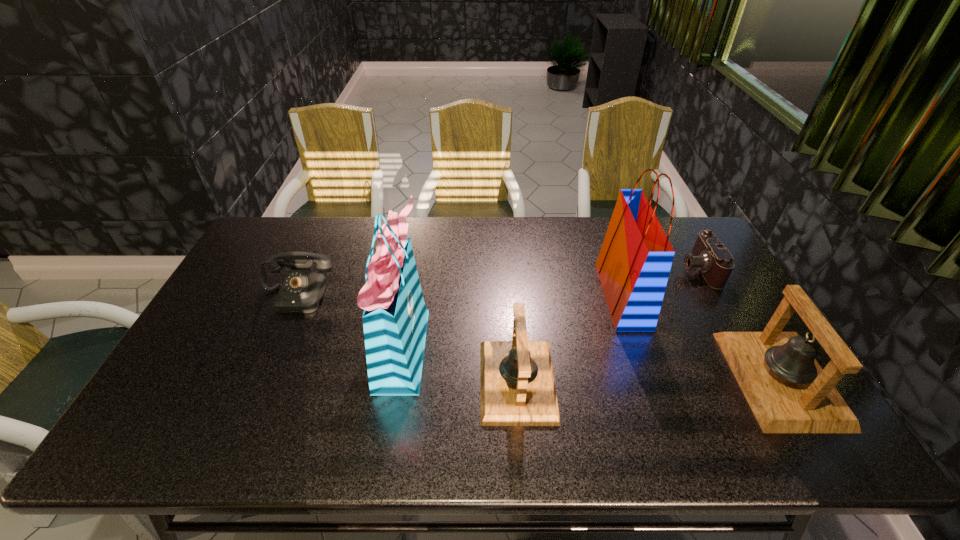
Locate an element on the screen. Image resolution: width=960 pixels, height=540 pixels. the shorter bell is located at coordinates (517, 383).

Locate an element on the screen. The width and height of the screenshot is (960, 540). the fourth object from right to left is located at coordinates 517,383.

Locate an element on the screen. The width and height of the screenshot is (960, 540). the right bell is located at coordinates (788, 391).

You are a GUI agent. You are given a task and a screenshot of the screen. Output one action in this format:
    pyautogui.click(x=<x>, y=<y>)
    Task: Click on the taller bell
    Image resolution: width=960 pixels, height=540 pixels.
    Given the screenshot: What is the action you would take?
    pyautogui.click(x=788, y=391)

Where is `the third object from right to left`? the third object from right to left is located at coordinates (635, 259).

Find the location of a particular element. camera is located at coordinates (715, 262).

At what (x,y) coordinates should I click in order to perform the action: click on telephone. Please return your answer as a coordinate pair (x, y). The image size is (960, 540). Looking at the image, I should click on (301, 292).

I want to click on the leftmost object, so click(301, 292).

You are a GUI agent. You are given a task and a screenshot of the screen. Output one action in this format:
    pyautogui.click(x=<x>, y=<y>)
    Task: Click on the second object from left to right
    The image size is (960, 540).
    Given the screenshot: What is the action you would take?
    pos(395,317)

Find the location of a particular element. vacant space located 0.340m on the right of the left bell is located at coordinates (688, 381).